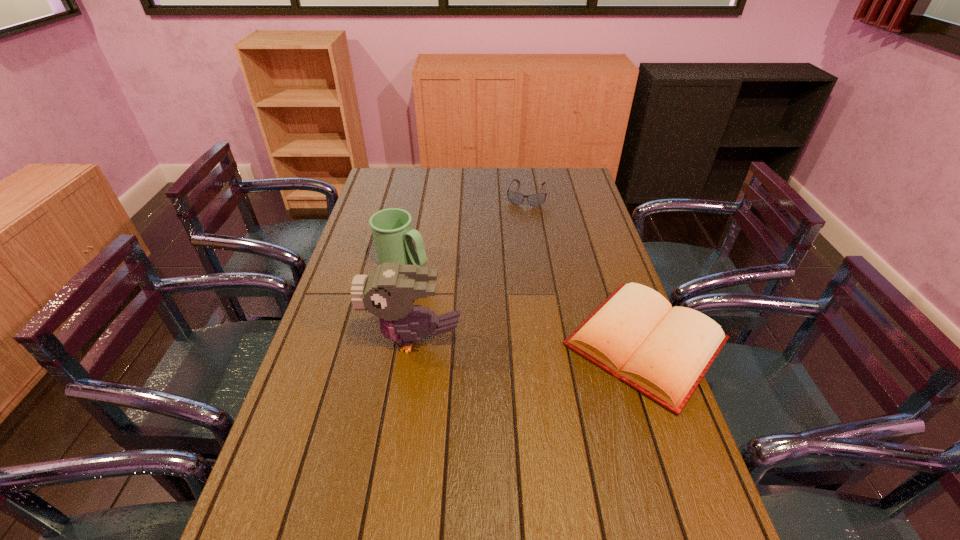
What are the coordinates of `vacant space on the desktop that is between the tallest object and the Bible and is positioned on the lenses of the sunglasses` in the screenshot? It's located at (496, 340).

The width and height of the screenshot is (960, 540). I want to click on vacant space on the desktop that is between the tallest object and the Bible and is positioned on the side of the mug with the handle, so click(558, 341).